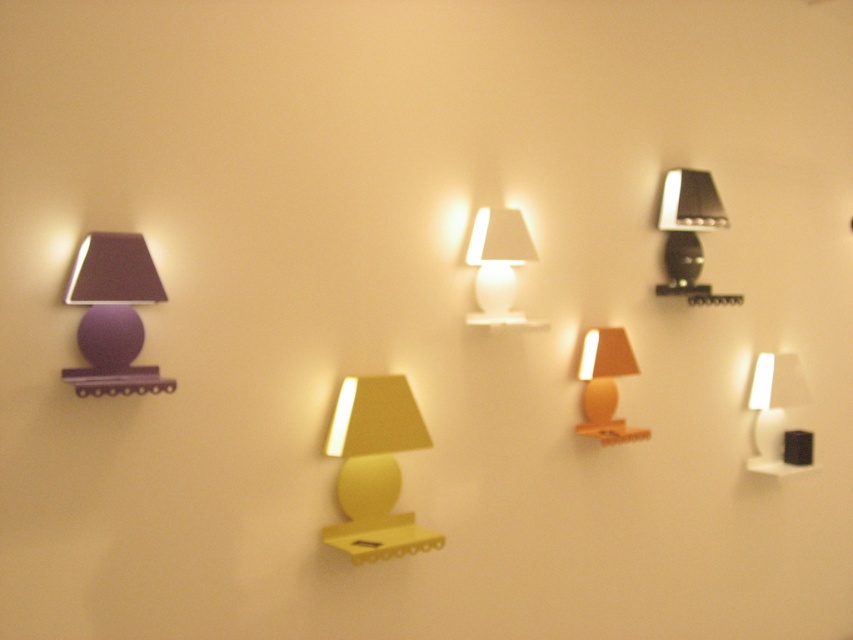
Between matte purple lamp at left and metallic silver lamp at upper right, which one appears on the left side from the viewer's perspective?

Positioned to the left is matte purple lamp at left.

Between point (155, 371) and point (676, 211), which one is positioned behind?

The point (676, 211) is behind.

Where is `matte purple lamp at left`? Image resolution: width=853 pixels, height=640 pixels. matte purple lamp at left is located at coordinates (113, 314).

Is point (337, 436) closer to viewer compared to point (672, 212)?

Yes, point (337, 436) is in front of point (672, 212).

Which is behind, point (372, 500) or point (659, 220)?

Positioned behind is point (659, 220).

This screenshot has width=853, height=640. What do you see at coordinates (374, 467) in the screenshot? I see `yellow matte lamp at center` at bounding box center [374, 467].

Locate an element on the screen. The height and width of the screenshot is (640, 853). yellow matte lamp at center is located at coordinates (374, 467).

Does white glossy lamp at right have a lesser width compared to white matte lamp at center?

In fact, white glossy lamp at right might be wider than white matte lamp at center.

Who is more forward, (x=758, y=429) or (x=488, y=273)?

Positioned in front is point (x=488, y=273).

Where is `white glossy lamp at right`? white glossy lamp at right is located at coordinates (778, 416).